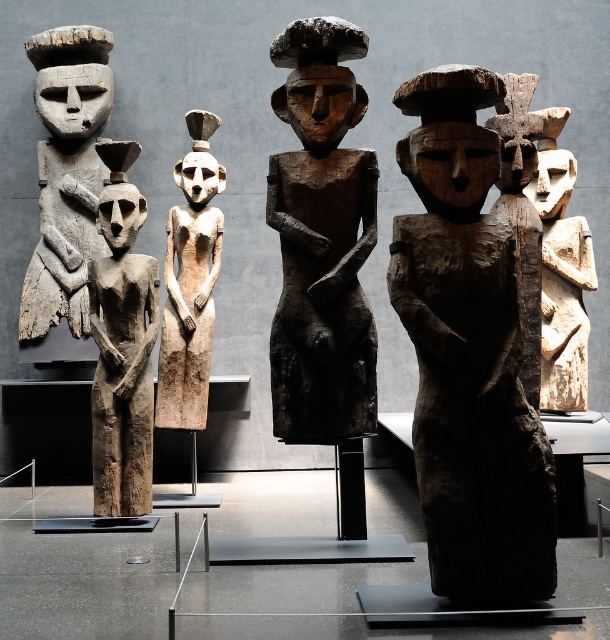
Question: Can you confirm if dark wood figure at center is positioned above wooden statue at left?

Choices:
 (A) no
 (B) yes

Answer: (A)

Question: Estimate the real-world distances between objects in this image. Which object is farther from the light brown wood figure at center?

Choices:
 (A) wooden figure at center
 (B) dark brown wood figure at center

Answer: (B)

Question: Which object is positioned farthest from the dark wood figure at center?

Choices:
 (A) wooden statue at left
 (B) light beige wood carving at right
 (C) wooden figure at center

Answer: (A)

Question: Can you confirm if wooden statue at left is thinner than light brown wood figure at center?

Choices:
 (A) yes
 (B) no

Answer: (B)

Question: Does wooden statue at left have a larger size compared to light brown wood figure at center?

Choices:
 (A) no
 (B) yes

Answer: (B)

Question: Which object appears closest to the camera in this image?

Choices:
 (A) dark wood figure at center
 (B) light beige wood carving at right
 (C) wooden statue at left

Answer: (A)